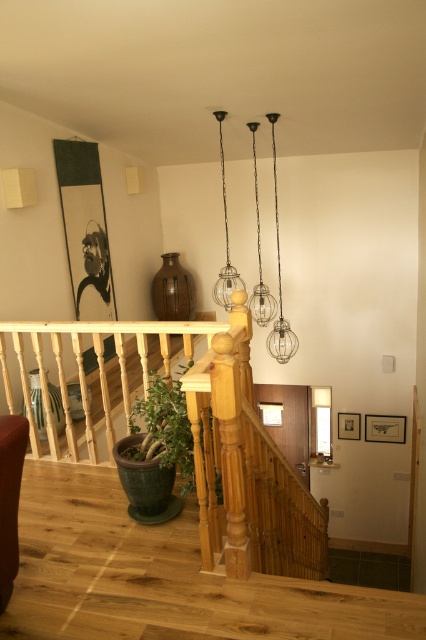
You are a delivery person carrying a large package that measures 24 inches in width. You need to navigate through the hallway and pass between the natural wood stair rail at center and the green matte plant at lower left. Will there be enough space for your package to fit through this gap?

The natural wood stair rail at center is 22.52 inches from the green matte plant at lower left. Since your package is 24 inches wide, it is slightly wider than the gap, so it will not fit through the space between them.

You are standing in the hallway and want to place a decorative item on the natural wood stair rail at center. However, there is already a green matte plant at lower left. Can you place the item on the rail without moving the plant?

The natural wood stair rail at center is located below the green matte plant at lower left, so placing an item on the rail would not interfere with the plant since they are at different levels.